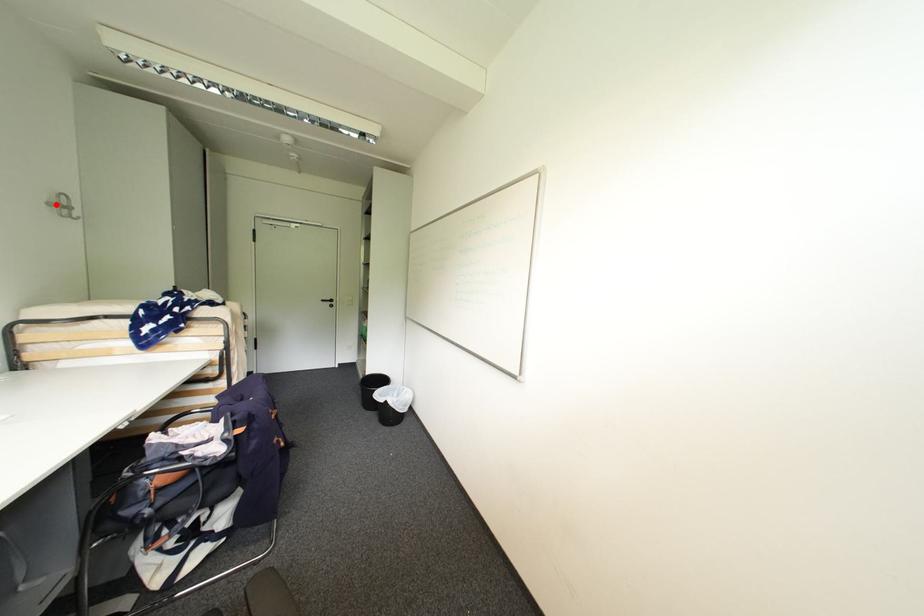
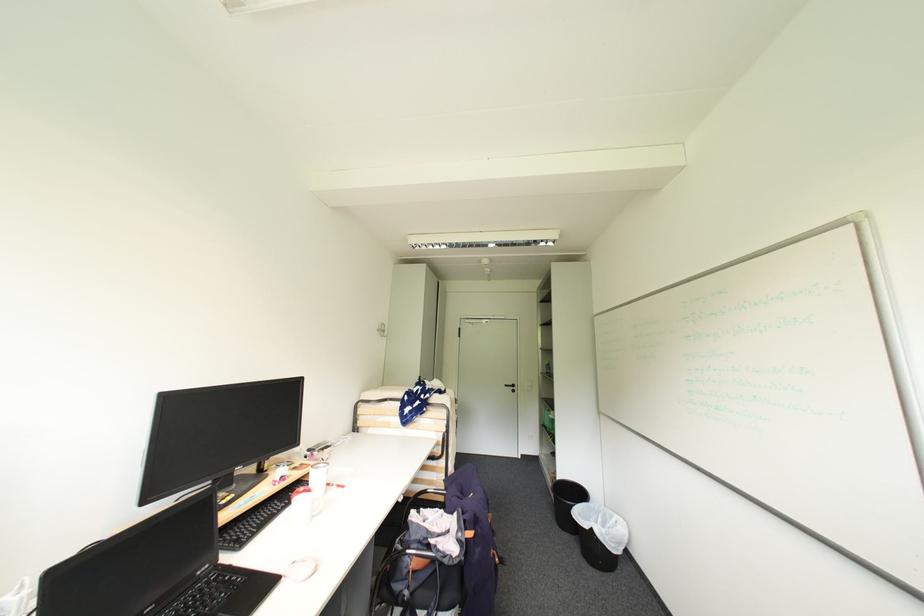
Where in the second image is the point corresponding to the highlighted location from the first image?

(384, 331)